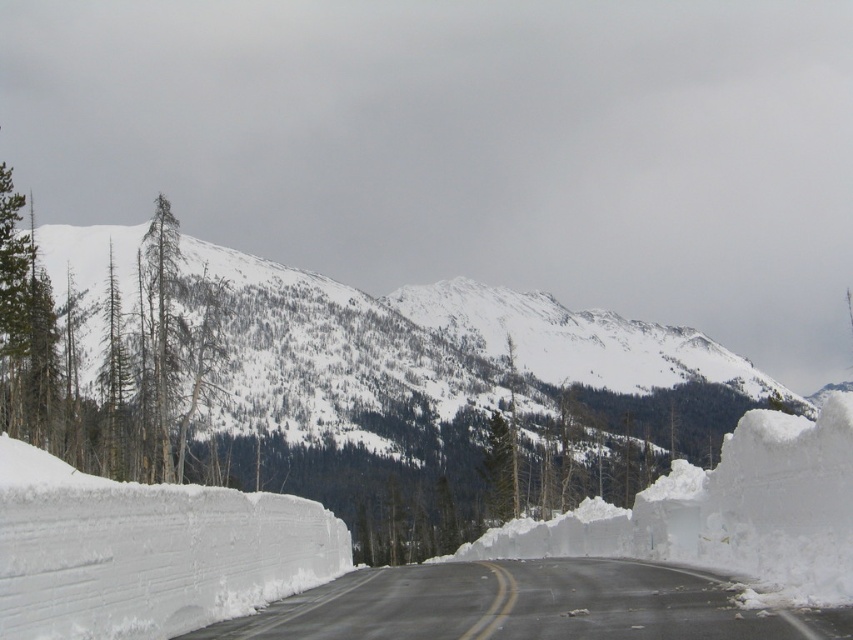
Question: Is white snow-covered mountain at upper center wider than green textured tree at upper left?

Choices:
 (A) no
 (B) yes

Answer: (B)

Question: Among these objects, which one is farthest from the camera?

Choices:
 (A) white snow-covered mountain at upper center
 (B) green textured tree at upper left
 (C) black asphalt road at center

Answer: (A)

Question: Is white snow-covered mountain at upper center to the left of green textured tree at upper left from the viewer's perspective?

Choices:
 (A) no
 (B) yes

Answer: (A)

Question: Which point appears closest to the camera in this image?

Choices:
 (A) (154, 397)
 (B) (300, 628)

Answer: (B)

Question: Does white snow-covered mountain at upper center have a lesser width compared to black asphalt road at center?

Choices:
 (A) yes
 (B) no

Answer: (B)

Question: Considering the real-world distances, which object is closest to the green textured tree at upper left?

Choices:
 (A) white snow-covered mountain at upper center
 (B) black asphalt road at center

Answer: (B)